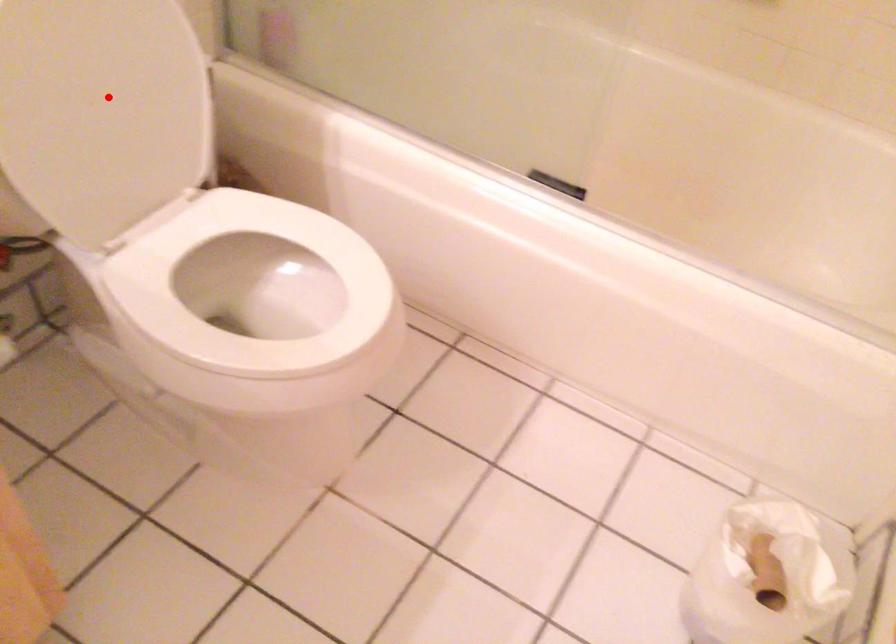
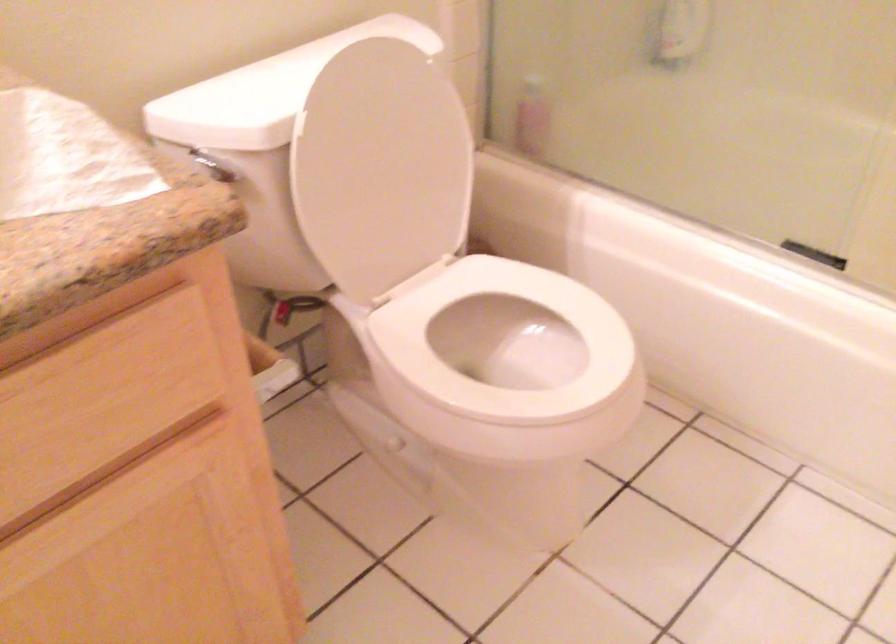
Find the pixel in the second image that matches the highlighted location in the first image.

(381, 167)